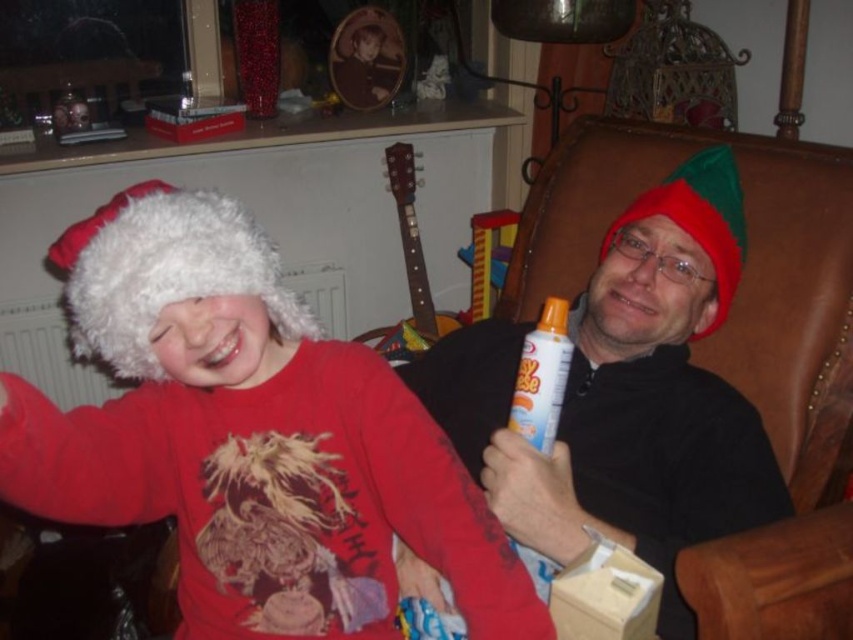
Question: Which of the following is the closest to the observer?

Choices:
 (A) (146, 413)
 (B) (486, 481)

Answer: (A)

Question: Is fuzzy white hat at left above fuzzy white hat at right?

Choices:
 (A) no
 (B) yes

Answer: (A)

Question: Which object appears closest to the camera in this image?

Choices:
 (A) fuzzy white hat at right
 (B) fuzzy white hat at left

Answer: (B)

Question: Where is fuzzy white hat at left located in relation to fuzzy white hat at right in the image?

Choices:
 (A) left
 (B) right

Answer: (A)

Question: Which point appears farthest from the camera in this image?

Choices:
 (A) (178, 500)
 (B) (569, 509)

Answer: (B)

Question: Is fuzzy white hat at left wider than fuzzy white hat at right?

Choices:
 (A) no
 (B) yes

Answer: (B)